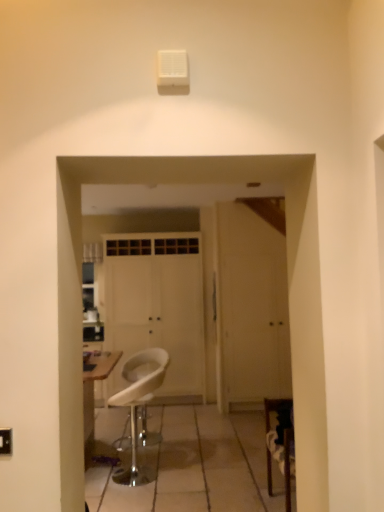
Question: From a real-world perspective, is white plastic stool at center physically located above or below white matte door at center, which is the first door in right-to-left order?

Choices:
 (A) below
 (B) above

Answer: (A)

Question: Considering the positions of white plastic stool at center and white matte door at center, placed as the second door when sorted from left to right, in the image, is white plastic stool at center bigger or smaller than white matte door at center, placed as the second door when sorted from left to right,?

Choices:
 (A) big
 (B) small

Answer: (B)

Question: Considering the real-world distances, which object is farthest from the white matte door at center, the 2th door from the right?

Choices:
 (A) white matte door at center, placed as the second door when sorted from left to right
 (B) white plastic stool at center

Answer: (B)

Question: Which of these objects is positioned farthest from the white plastic stool at center?

Choices:
 (A) white matte door at center, the 2th door from the right
 (B) white matte door at center, placed as the second door when sorted from left to right

Answer: (B)